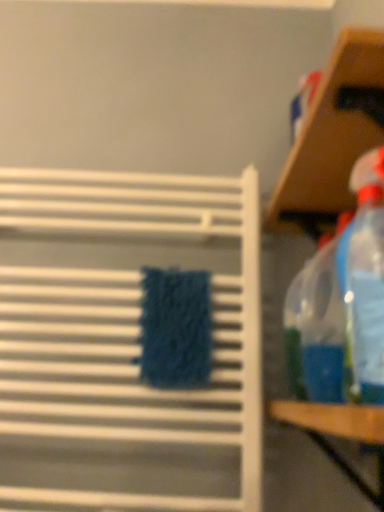
Question: Can you confirm if transparent plastic shelf at upper right, which is the first shelf in right-to-left order, is wider than white textured towel rack at center, the second shelf when ordered from right to left?

Choices:
 (A) yes
 (B) no

Answer: (A)

Question: Can you confirm if transparent plastic shelf at upper right, which is the first shelf in right-to-left order, is bigger than white textured towel rack at center, which is the 1th shelf in left-to-right order?

Choices:
 (A) no
 (B) yes

Answer: (B)

Question: Considering the relative sizes of transparent plastic shelf at upper right, which is the first shelf in right-to-left order, and white textured towel rack at center, the second shelf when ordered from right to left, in the image provided, is transparent plastic shelf at upper right, which is the first shelf in right-to-left order, shorter than white textured towel rack at center, the second shelf when ordered from right to left,?

Choices:
 (A) no
 (B) yes

Answer: (B)

Question: Is transparent plastic shelf at upper right, which is the first shelf in right-to-left order, to the right of white textured towel rack at center, the second shelf when ordered from right to left, from the viewer's perspective?

Choices:
 (A) no
 (B) yes

Answer: (B)

Question: Can you confirm if transparent plastic shelf at upper right, which is the first shelf in right-to-left order, is thinner than white textured towel rack at center, the second shelf when ordered from right to left?

Choices:
 (A) yes
 (B) no

Answer: (B)

Question: Does point (339, 56) appear closer or farther from the camera than point (307, 432)?

Choices:
 (A) farther
 (B) closer

Answer: (B)

Question: Would you say transparent plastic shelf at upper right, which is the first shelf in right-to-left order, is to the left or to the right of wooden table at right in the picture?

Choices:
 (A) right
 (B) left

Answer: (A)

Question: Considering the positions of transparent plastic shelf at upper right, which is the first shelf in right-to-left order, and wooden table at right in the image, is transparent plastic shelf at upper right, which is the first shelf in right-to-left order, taller or shorter than wooden table at right?

Choices:
 (A) tall
 (B) short

Answer: (A)

Question: From a real-world perspective, relative to wooden table at right, is transparent plastic shelf at upper right, marked as the 2th shelf in a left-to-right arrangement, vertically above or below?

Choices:
 (A) below
 (B) above

Answer: (B)

Question: Is white textured towel rack at center, which is the 1th shelf in left-to-right order, wider or thinner than transparent plastic spray bottle at right?

Choices:
 (A) thin
 (B) wide

Answer: (A)

Question: From the image's perspective, relative to transparent plastic spray bottle at right, is white textured towel rack at center, the second shelf when ordered from right to left, above or below?

Choices:
 (A) below
 (B) above

Answer: (A)

Question: From a real-world perspective, is white textured towel rack at center, which is the 1th shelf in left-to-right order, above or below transparent plastic spray bottle at right?

Choices:
 (A) above
 (B) below

Answer: (B)

Question: Considering the positions of white textured towel rack at center, which is the 1th shelf in left-to-right order, and transparent plastic spray bottle at right in the image, is white textured towel rack at center, which is the 1th shelf in left-to-right order, taller or shorter than transparent plastic spray bottle at right?

Choices:
 (A) tall
 (B) short

Answer: (A)

Question: In the image, is wooden table at right positioned in front of or behind white textured towel rack at center, the second shelf when ordered from right to left?

Choices:
 (A) front
 (B) behind

Answer: (A)

Question: Is wooden table at right wider or thinner than white textured towel rack at center, which is the 1th shelf in left-to-right order?

Choices:
 (A) thin
 (B) wide

Answer: (B)